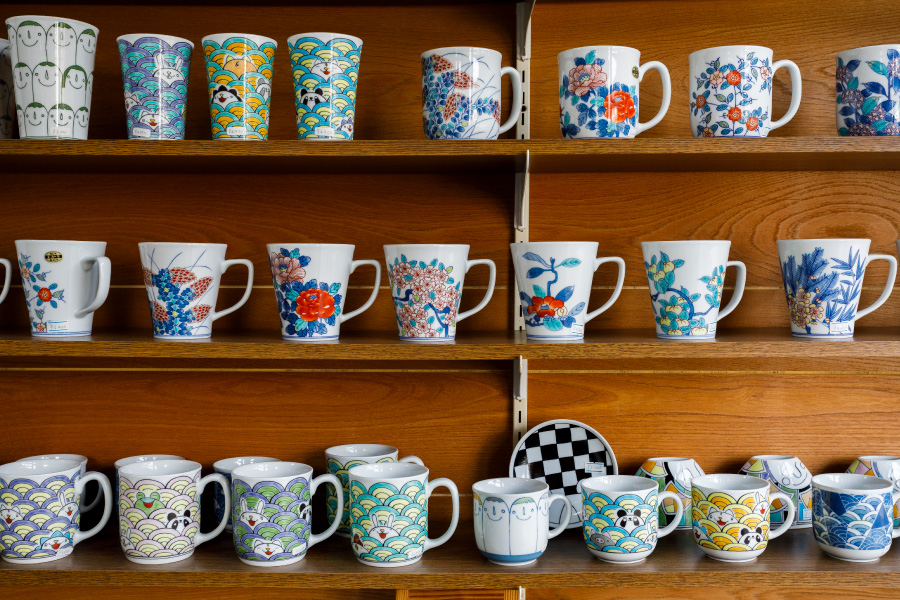
Locate an element on the screen. cups on the top shelf is located at coordinates (58, 97), (151, 90), (238, 79), (319, 85), (463, 96), (590, 94), (736, 94), (875, 73).